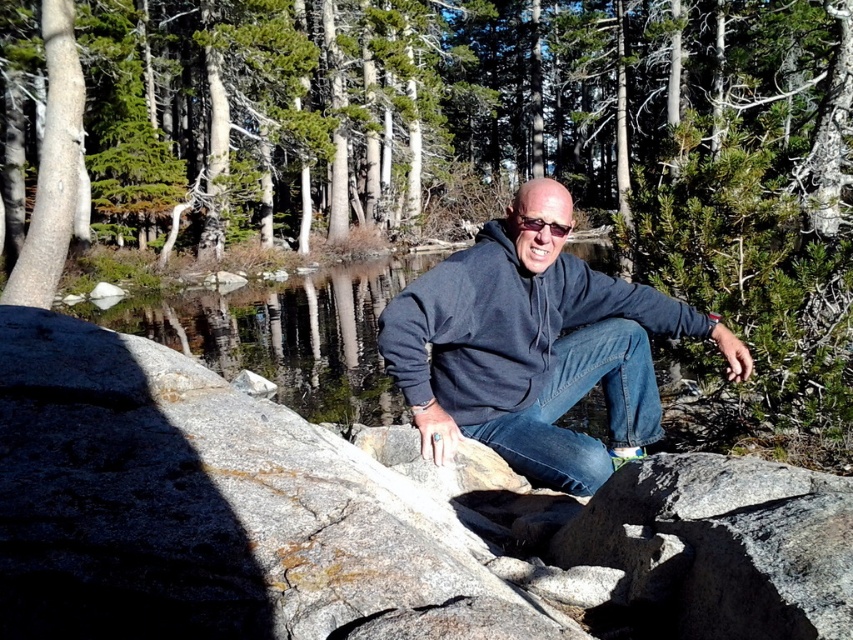
Between point (160, 67) and point (630, 403), which one is positioned in front?

Point (630, 403)

Does green textured pine tree at upper center appear over denim at center?

Yes.

Is point (245, 186) less distant than point (554, 381)?

No, it is not.

You are a GUI agent. You are given a task and a screenshot of the screen. Output one action in this format:
    pyautogui.click(x=<x>, y=<y>)
    Task: Click on the green textured pine tree at upper center
    
    Given the screenshot: What is the action you would take?
    pyautogui.click(x=445, y=104)

Does dark blue hoodie at center have a greater width compared to denim at center?

Indeed, dark blue hoodie at center has a greater width compared to denim at center.

Can you confirm if dark blue hoodie at center is thinner than denim at center?

No.

Between point (524, 276) and point (582, 381), which one is positioned in front?

Point (524, 276)

Locate an element on the screen. dark blue hoodie at center is located at coordinates (534, 348).

Can you confirm if green textured pine tree at upper center is smaller than dark blue hoodie at center?

No, green textured pine tree at upper center is not smaller than dark blue hoodie at center.

Between green textured pine tree at upper center and dark blue hoodie at center, which one has more height?

green textured pine tree at upper center

Which is behind, point (190, 172) or point (500, 456)?

Positioned behind is point (190, 172).

Where is `green textured pine tree at upper center`? green textured pine tree at upper center is located at coordinates (x=445, y=104).